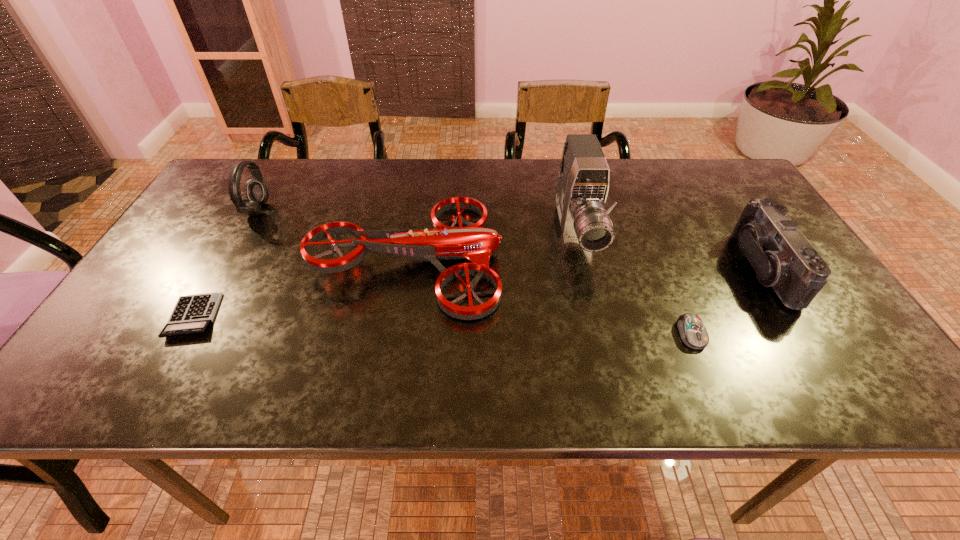
Where is `vacant region located at the front of the left camcorder, highlighting the lens`? The height and width of the screenshot is (540, 960). vacant region located at the front of the left camcorder, highlighting the lens is located at coordinates (596, 317).

Find the location of a particular element. The width and height of the screenshot is (960, 540). vacant area situated 0.230m on the earcups of the headset is located at coordinates (349, 210).

The height and width of the screenshot is (540, 960). What are the coordinates of `free space located 0.360m on the front-facing side of the right camcorder` in the screenshot? It's located at pyautogui.click(x=595, y=268).

You are a GUI agent. You are given a task and a screenshot of the screen. Output one action in this format:
    pyautogui.click(x=<x>, y=<y>)
    Task: Click on the vacant region located 0.270m on the front-facing side of the right camcorder
    
    Given the screenshot: What is the action you would take?
    pyautogui.click(x=632, y=268)

Find the location of a particular element. free location located 0.180m on the front-facing side of the right camcorder is located at coordinates (668, 268).

What are the coordinates of `free space located on the right of the third object from left to right` in the screenshot? It's located at click(572, 256).

You are a GUI agent. You are given a task and a screenshot of the screen. Output one action in this format:
    pyautogui.click(x=<x>, y=<y>)
    Task: Click on the vacant region located 0.100m on the wheel side of the second shortest object
    
    Given the screenshot: What is the action you would take?
    pyautogui.click(x=715, y=394)

The image size is (960, 540). In order to click on free spot located on the back of the shortest object in this screenshot , I will do `click(234, 245)`.

You are a GUI agent. You are given a task and a screenshot of the screen. Output one action in this format:
    pyautogui.click(x=<x>, y=<y>)
    Task: Click on the camcorder that is at the far edge
    The height and width of the screenshot is (540, 960).
    Given the screenshot: What is the action you would take?
    pyautogui.click(x=583, y=177)

Locate an element on the screen. headset at the far edge is located at coordinates (257, 191).